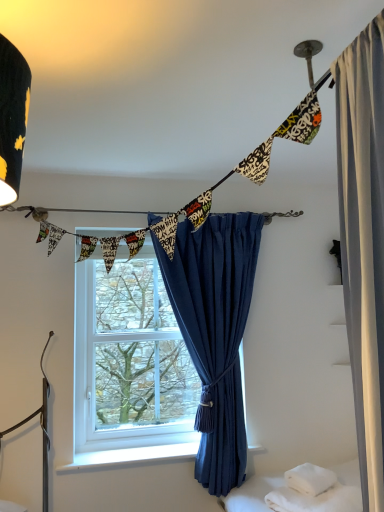
I want to click on clear glass window at center, so (129, 358).

What do you see at coordinates (215, 332) in the screenshot?
I see `blue velvet curtain at center` at bounding box center [215, 332].

Find the location of a particular element. white smooth window sill at lower center is located at coordinates (130, 456).

This screenshot has height=512, width=384. Find the location of `white soft pillow at lower right`. white soft pillow at lower right is located at coordinates (310, 479).

This screenshot has width=384, height=512. Describe the element at coordinates (316, 500) in the screenshot. I see `white soft towel at lower right` at that location.

Locate an element on the screen. This screenshot has width=384, height=512. clear glass window at center is located at coordinates (129, 358).

Can you confirm if printed fabric bunting at upper center is shorter than white soft pillow at lower right?

No.

Would you say printed fabric bunting at upper center is outside white soft pillow at lower right?

printed fabric bunting at upper center is positioned outside white soft pillow at lower right.

Which is behind, printed fabric bunting at upper center or white soft pillow at lower right?

white soft pillow at lower right is behind.

From the image's perspective, which object appears higher, printed fabric bunting at upper center or white soft pillow at lower right?

printed fabric bunting at upper center appears higher in the image.

Which object is positioned more to the left, white soft towel at lower right or white soft pillow at lower right?

white soft pillow at lower right is more to the left.

Which object is further away from the camera taking this photo, white soft towel at lower right or white soft pillow at lower right?

white soft pillow at lower right is further from the camera.

In the scene shown: Considering the relative sizes of white soft towel at lower right and white soft pillow at lower right in the image provided, is white soft towel at lower right taller than white soft pillow at lower right?

Indeed, white soft towel at lower right has a greater height compared to white soft pillow at lower right.

Where is `pillow behind the white soft towel at lower right`? This screenshot has height=512, width=384. pillow behind the white soft towel at lower right is located at coordinates (310, 479).

Which is closer to the camera, (205, 207) or (197, 442)?

Point (205, 207) appears to be closer to the viewer than point (197, 442).

Is printed fabric bunting at upper center positioned beyond the bounds of white smooth window sill at lower center?

printed fabric bunting at upper center lies outside white smooth window sill at lower center's area.

Identify the location of window sill lying behind the printed fabric bunting at upper center. (130, 456).

Looking at this image, can you confirm if printed fabric bunting at upper center is shorter than white smooth window sill at lower center?

Incorrect, the height of printed fabric bunting at upper center does not fall short of that of white smooth window sill at lower center.

Is white soft pillow at lower right inside the boundaries of clear glass window at center, or outside?

white soft pillow at lower right is outside clear glass window at center.

Considering the relative sizes of white soft pillow at lower right and clear glass window at center in the image provided, is white soft pillow at lower right wider than clear glass window at center?

Yes, white soft pillow at lower right is wider than clear glass window at center.

Does white soft pillow at lower right have a larger size compared to clear glass window at center?

No, white soft pillow at lower right is not bigger than clear glass window at center.

Is white soft towel at lower right looking in the opposite direction of blue velvet curtain at center?

Yes, white soft towel at lower right is facing away from blue velvet curtain at center.

Considering the sizes of objects white soft towel at lower right and blue velvet curtain at center in the image provided, who is taller, white soft towel at lower right or blue velvet curtain at center?

Standing taller between the two is blue velvet curtain at center.

Which is more to the right, white soft towel at lower right or blue velvet curtain at center?

white soft towel at lower right.

Can you confirm if clear glass window at center is wider than white smooth window sill at lower center?

In fact, clear glass window at center might be narrower than white smooth window sill at lower center.

Identify the location of window sill located in front of the clear glass window at center. Image resolution: width=384 pixels, height=512 pixels. (130, 456).

Based on the photo, which is more to the right, clear glass window at center or white smooth window sill at lower center?

white smooth window sill at lower center.

From the image's perspective, would you say clear glass window at center is shown under white smooth window sill at lower center?

Incorrect, from the image's perspective, clear glass window at center is higher than white smooth window sill at lower center.

Is white soft pillow at lower right oriented away from printed fabric bunting at upper center?

white soft pillow at lower right does not have its back to printed fabric bunting at upper center.

Is white soft pillow at lower right behind printed fabric bunting at upper center?

Yes, white soft pillow at lower right is behind printed fabric bunting at upper center.

Which point is more forward, [333,476] or [279,128]?

The point [279,128] is more forward.

Is white soft pillow at lower right not within printed fabric bunting at upper center?

Yes, white soft pillow at lower right is not within printed fabric bunting at upper center.

Identify the location of clothesline in front of the white soft pillow at lower right. [217, 184].

The image size is (384, 512). Find the location of `pillow above the white soft towel at lower right (from the image's perspective)`. pillow above the white soft towel at lower right (from the image's perspective) is located at coordinates (310, 479).

When comparing their distances from white soft pillow at lower right, does white smooth window sill at lower center or printed fabric bunting at upper center seem closer?

The object closer to white soft pillow at lower right is white smooth window sill at lower center.

Considering their positions, is clear glass window at center positioned closer to printed fabric bunting at upper center than white soft pillow at lower right?

Among the two, clear glass window at center is located nearer to printed fabric bunting at upper center.

Considering their positions, is clear glass window at center positioned further to white soft pillow at lower right than white smooth window sill at lower center?

clear glass window at center lies further to white soft pillow at lower right than the other object.

Estimate the real-world distances between objects in this image. Which object is further from clear glass window at center, blue velvet curtain at center or white soft towel at lower right?

white soft towel at lower right.

Considering their positions, is blue velvet curtain at center positioned closer to white soft pillow at lower right than printed fabric bunting at upper center?

blue velvet curtain at center is positioned closer to the anchor white soft pillow at lower right.

When comparing their distances from printed fabric bunting at upper center, does white soft towel at lower right or white smooth window sill at lower center seem further?

The object further to printed fabric bunting at upper center is white soft towel at lower right.

Estimate the real-world distances between objects in this image. Which object is closer to white soft towel at lower right, white smooth window sill at lower center or clear glass window at center?

Based on the image, white smooth window sill at lower center appears to be nearer to white soft towel at lower right.

Considering their positions, is blue velvet curtain at center positioned further to white soft towel at lower right than white soft pillow at lower right?

Based on the image, blue velvet curtain at center appears to be further to white soft towel at lower right.

The image size is (384, 512). In order to click on curtain between white smooth window sill at lower center and white soft towel at lower right from left to right in this screenshot , I will do `click(215, 332)`.

You are a GUI agent. You are given a task and a screenshot of the screen. Output one action in this format:
    pyautogui.click(x=<x>, y=<y>)
    Task: Click on the window sill between printed fabric bunting at upper center and white soft towel at lower right in the vertical direction
    
    Given the screenshot: What is the action you would take?
    pyautogui.click(x=130, y=456)

The width and height of the screenshot is (384, 512). I want to click on pillow between printed fabric bunting at upper center and white soft towel at lower right in the up-down direction, so click(310, 479).

Where is `window sill between clear glass window at center and white soft pillow at lower right in the horizontal direction`? The width and height of the screenshot is (384, 512). window sill between clear glass window at center and white soft pillow at lower right in the horizontal direction is located at coordinates (130, 456).